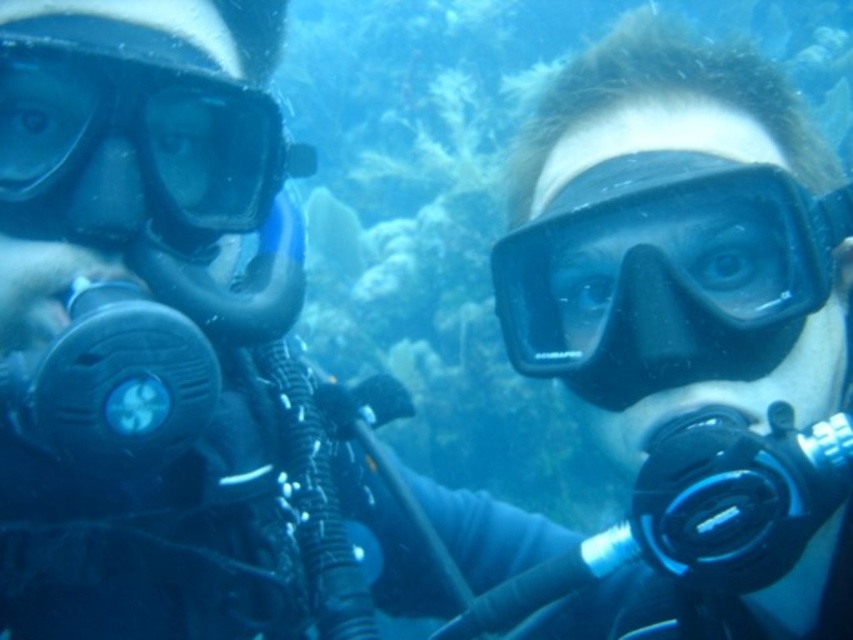
You are a marine biologist studying underwater equipment placement. You need to locate the black matte scuba mask at right in the image. Based on the coordinates provided, where would you find it?

The black matte scuba mask at right is located at point (665,275).